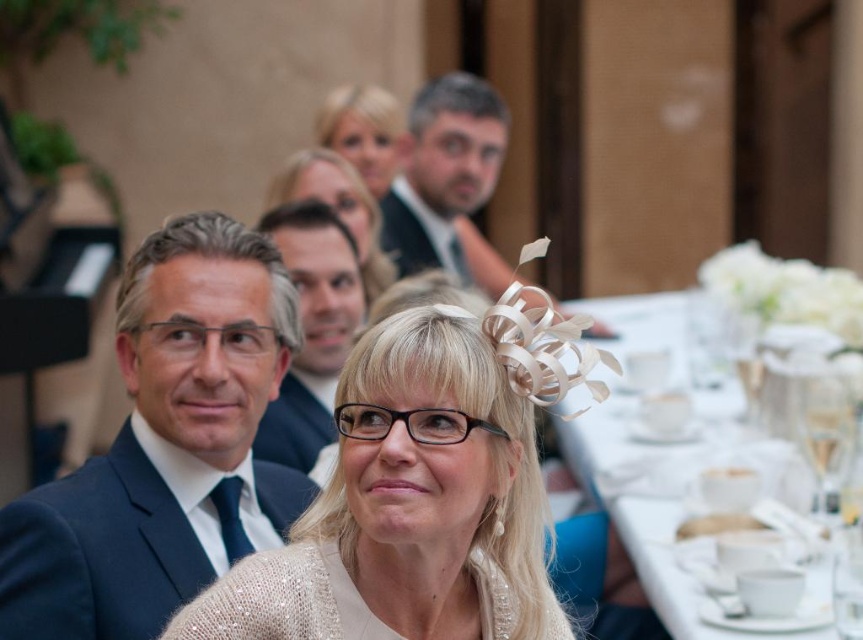
Question: Is dark blue suit at center to the left of sparkly beige dress at center from the viewer's perspective?

Choices:
 (A) yes
 (B) no

Answer: (A)

Question: Among these points, which one is farthest from the camera?

Choices:
 (A) (325, 180)
 (B) (244, 349)
 (C) (513, 467)

Answer: (A)

Question: Is dark blue suit at center to the left of smooth dark brown suit at center from the viewer's perspective?

Choices:
 (A) no
 (B) yes

Answer: (B)

Question: Does dark blue suit at center have a smaller size compared to sparkly beige dress at center?

Choices:
 (A) no
 (B) yes

Answer: (A)

Question: Which of the following is the closest to the observer?

Choices:
 (A) (388, 134)
 (B) (432, 502)
 (C) (606, 460)

Answer: (B)

Question: Which point is closer to the camera taking this photo?

Choices:
 (A) (364, 134)
 (B) (110, 528)
 (C) (213, 634)
 (D) (299, 422)

Answer: (C)